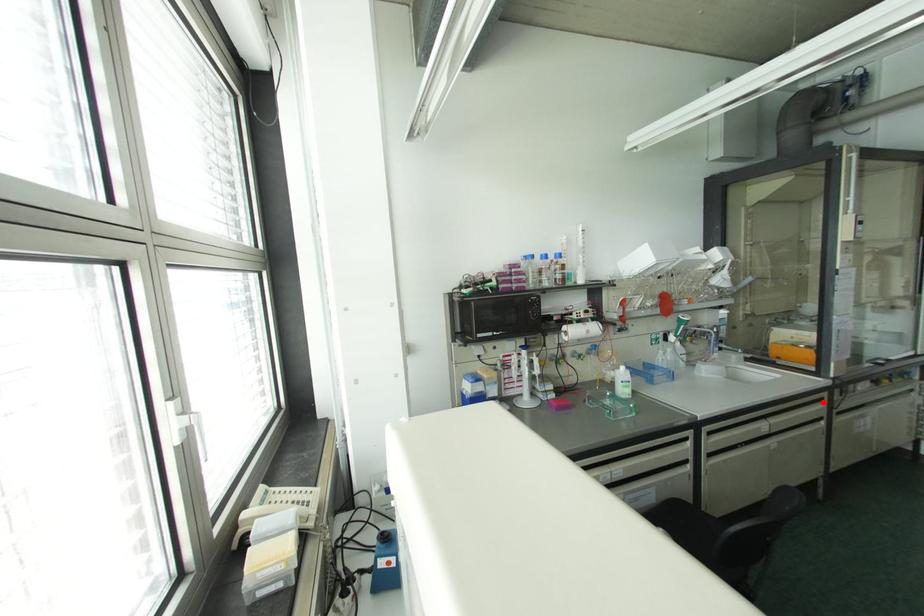
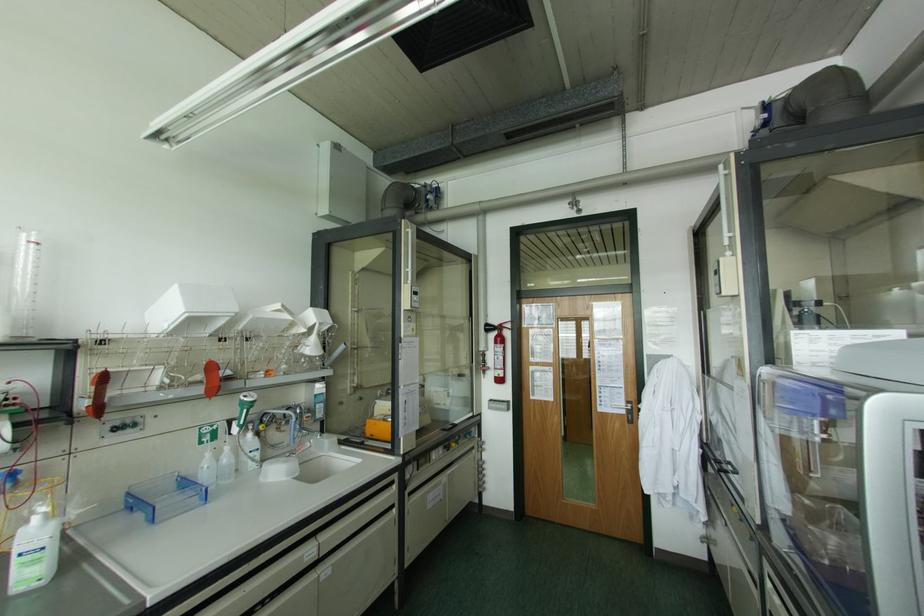
Locate, in the second image, the point that corresponds to the highlighted location in the first image.

(394, 485)